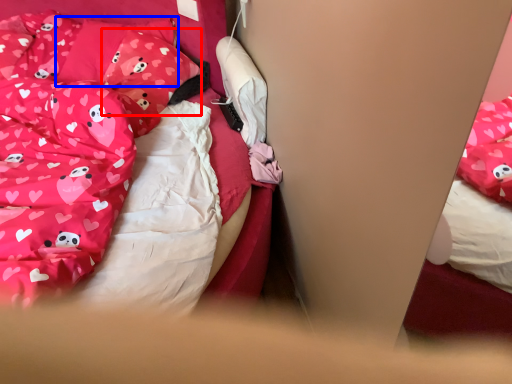
Question: Which point is further to the camera, pillow (highlighted by a red box) or pillow (highlighted by a blue box)?

Choices:
 (A) pillow
 (B) pillow

Answer: (B)